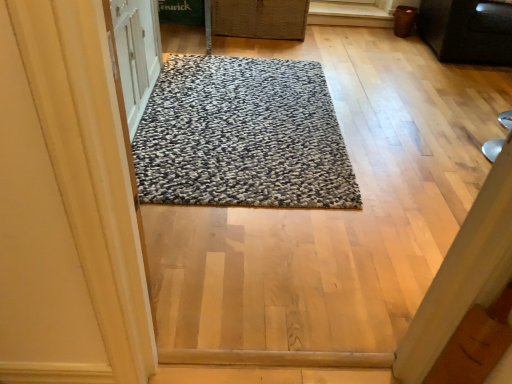
Question: Considering the positions of point (223, 19) and point (494, 21), is point (223, 19) closer or farther from the camera than point (494, 21)?

Choices:
 (A) farther
 (B) closer

Answer: (A)

Question: Looking at their shapes, would you say woven brown basket at upper center is wider or thinner than black matte cabinet at upper right?

Choices:
 (A) wide
 (B) thin

Answer: (B)

Question: Based on their relative distances, which object is nearer to the textured gray rug at center?

Choices:
 (A) woven brown basket at upper center
 (B) black matte cabinet at upper right

Answer: (A)

Question: Estimate the real-world distances between objects in this image. Which object is farther from the woven brown basket at upper center?

Choices:
 (A) black matte cabinet at upper right
 (B) textured gray rug at center

Answer: (A)